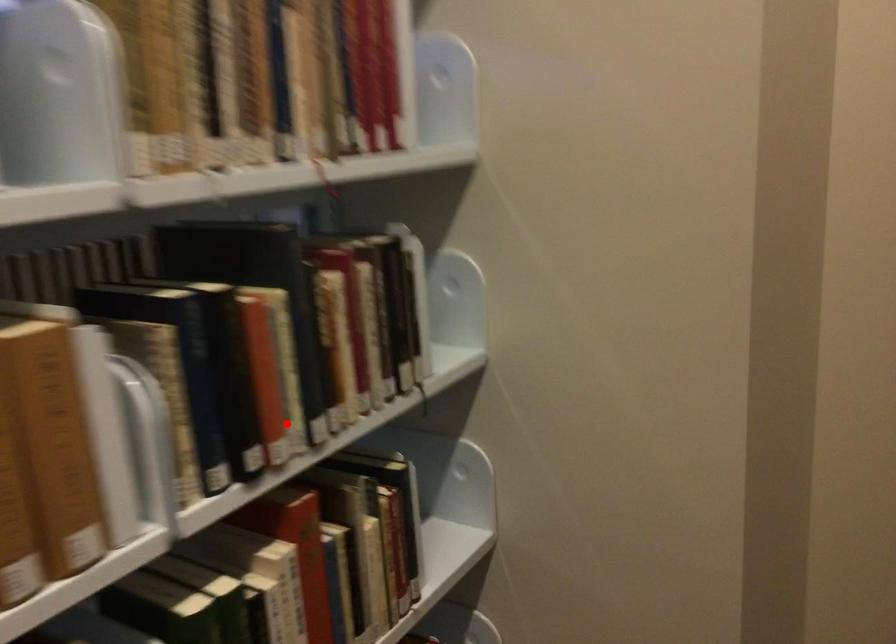
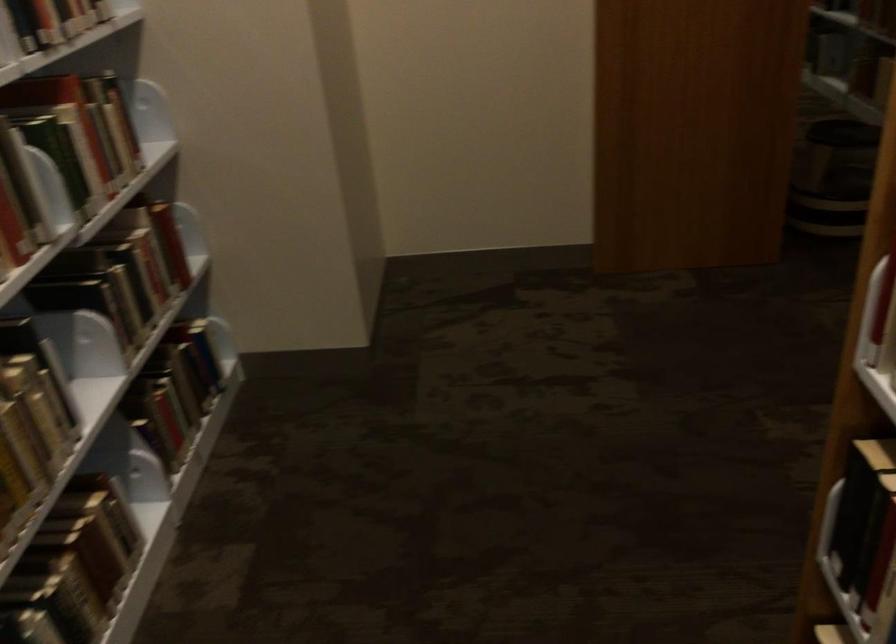
In the second image, find the point that corresponds to the highlighted location in the first image.

(46, 24)